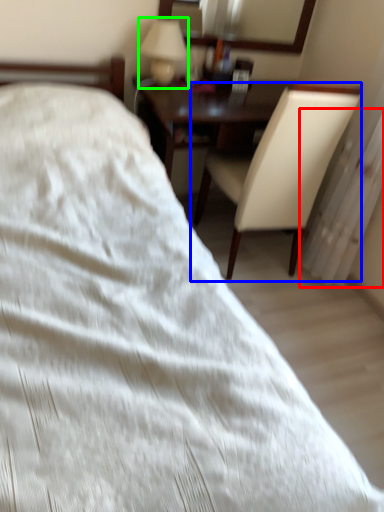
Question: Considering the real-world distances, which object is farthest from radiator (highlighted by a red box)? chair (highlighted by a blue box) or table lamp (highlighted by a green box)?

Choices:
 (A) chair
 (B) table lamp

Answer: (B)